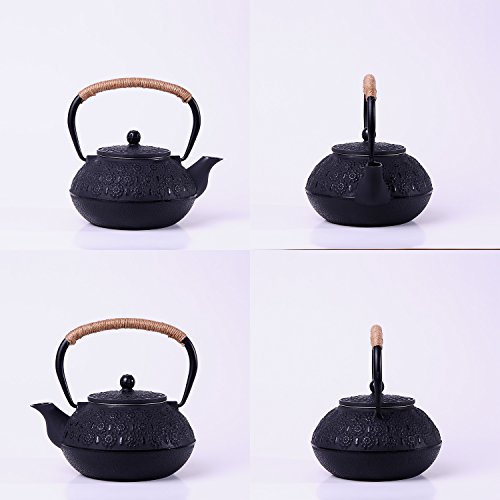
I want to click on connecting handle piece to bottom of kettle, so click(77, 404), click(171, 401).